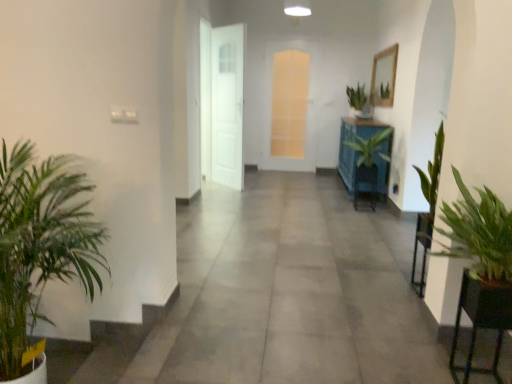
Question: Considering their positions, is green leafy plant at left located in front of or behind green leafy plant at left, the 4th houseplant in the back-to-front sequence?

Choices:
 (A) behind
 (B) front

Answer: (A)

Question: Is green leafy plant at left taller or shorter than green leafy plant at left, the 4th houseplant in the back-to-front sequence?

Choices:
 (A) short
 (B) tall

Answer: (A)

Question: Which of these objects is positioned farthest from the green glossy plant at center, positioned as the 2th houseplant in back-to-front order?

Choices:
 (A) green leafy plant at right
 (B) white glossy door at center, the 2th door in the back-to-front sequence
 (C) green leafy plant at left, the first houseplant positioned from the left
 (D) translucent glass door at center, positioned as the 1th door in right-to-left order
 (E) green leafy plant at left

Answer: (C)

Question: Which of these objects is positioned farthest from the green leafy plant at right, the 2th houseplant from the left?

Choices:
 (A) white glossy door at center, the 2th door in the back-to-front sequence
 (B) translucent glass door at center, the 1th door when ordered from back to front
 (C) green leafy plant at left
 (D) green leafy plant at right
 (E) green glossy plant at center, positioned as the 2th houseplant in back-to-front order

Answer: (B)